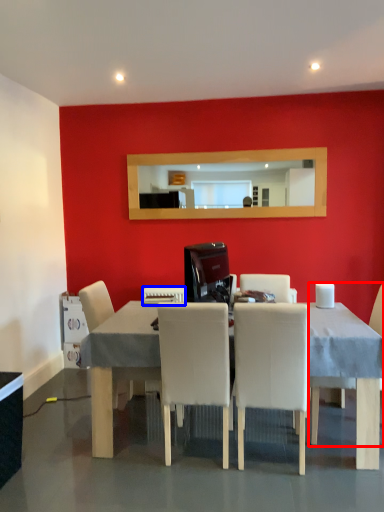
Question: Which point is further to the camera, chair (highlighted by a red box) or appliance (highlighted by a blue box)?

Choices:
 (A) chair
 (B) appliance

Answer: (B)